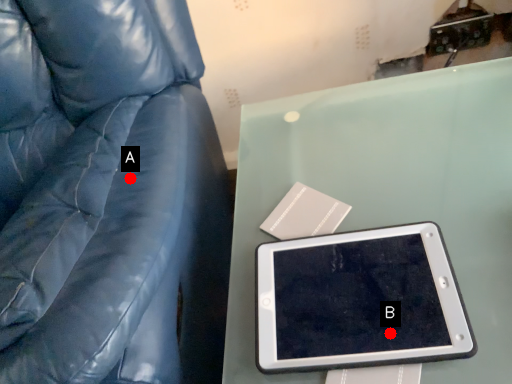
Question: Two points are circled on the image, labeled by A and B beside each circle. Which point appears closest to the camera in this image?

Choices:
 (A) A is closer
 (B) B is closer

Answer: (A)